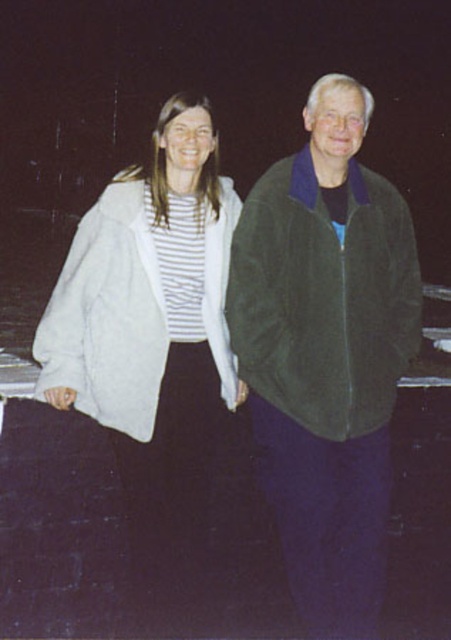
You are trying to decide which jacket to buy based on the image. The store says the dark green suede jacket at right is available in your size, but the white fuzzy jacket at center might be too small. According to the image, which jacket should you choose?

The dark green suede jacket at right has a larger size compared to the white fuzzy jacket at center, so you should choose the dark green suede jacket at right since it is available in your size and is larger.

You are a photographer who needs to adjust the lighting to ensure both jackets are visible. Since the dark green suede jacket at right is positioned to the right of the white fuzzy jacket at center, which jacket should you focus the light on first to account for their positions?

The dark green suede jacket at right should be focused on first because it is positioned to the right of the white fuzzy jacket at center, so adjusting the light starting from the right ensures both jackets receive adequate illumination.

You are a photographer setting up a photo shoot. You have two jackets to place in the frame. The dark green suede jacket at right and the white fuzzy jacket at center. Which jacket should you place higher in the frame to maintain the height relationship shown in the scene?

The dark green suede jacket at right should be placed higher in the frame since it is much taller than the white fuzzy jacket at center.